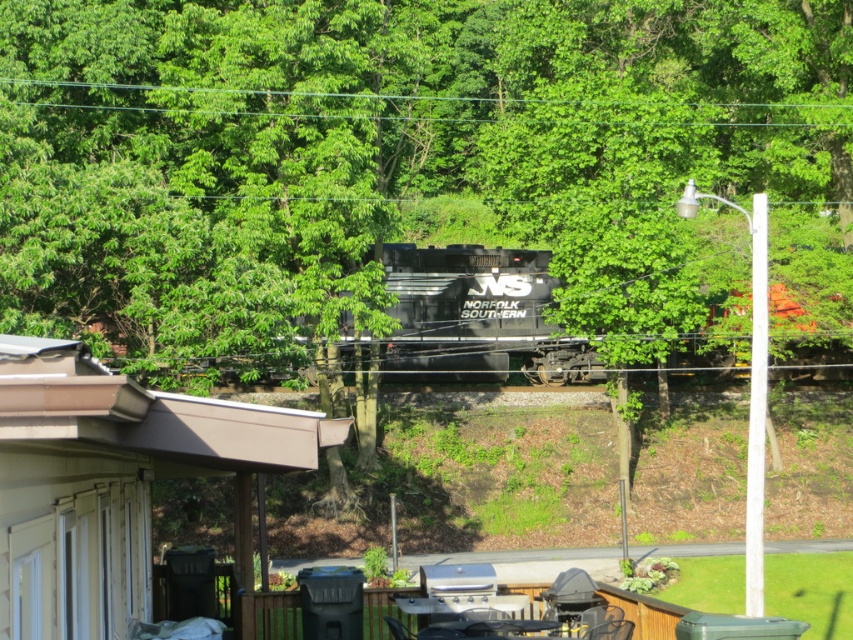
Does brown wood shed at lower left have a greater width compared to black matte train at center?

No, brown wood shed at lower left is not wider than black matte train at center.

Does brown wood shed at lower left appear over black matte train at center?

No.

Does point (44, 520) come behind point (549, 252)?

No, (44, 520) is closer to viewer.

You are a GUI agent. You are given a task and a screenshot of the screen. Output one action in this format:
    pyautogui.click(x=<x>, y=<y>)
    Task: Click on the brown wood shed at lower left
    The width and height of the screenshot is (853, 640).
    Given the screenshot: What is the action you would take?
    pyautogui.click(x=113, y=481)